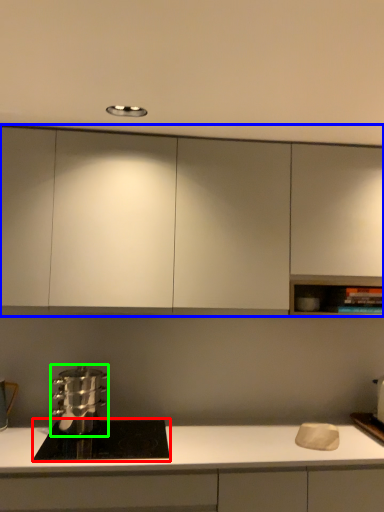
Question: Considering the real-world distances, which object is farthest from home appliance (highlighted by a red box)? cabinetry (highlighted by a blue box) or kitchen appliance (highlighted by a green box)?

Choices:
 (A) cabinetry
 (B) kitchen appliance

Answer: (A)